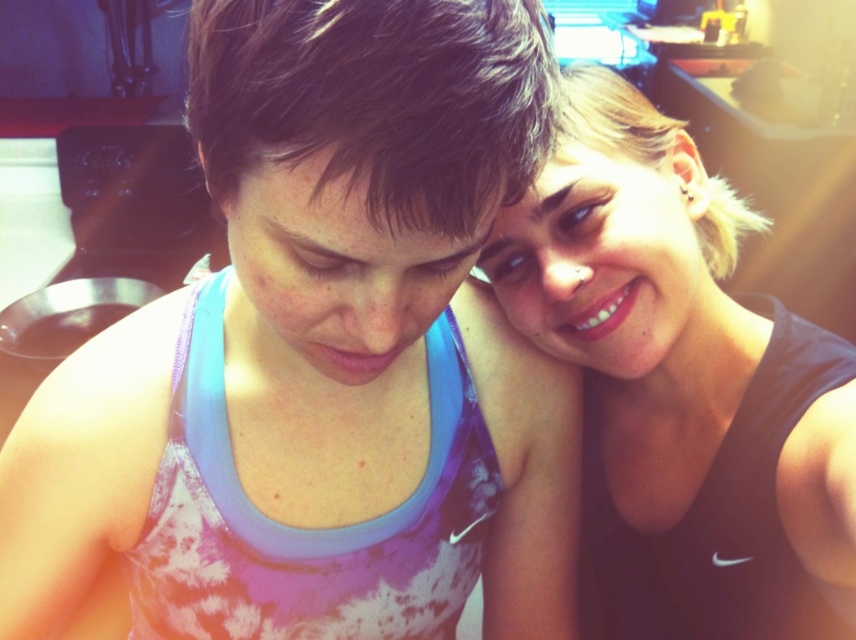
You are a photographer trying to capture a closeup of the matte blue tank top at upper right and the matte black tank top at upper right. Which one will appear larger in your photo?

The matte blue tank top at upper right will appear larger in the photo because it is closer to the viewer than the matte black tank top at upper right.

You are standing in front of the image and want to locate the matte blue tank top at upper right. According to the coordinates provided, where exactly is it positioned?

The matte blue tank top at upper right is positioned at the 2D coordinates point (x=321, y=355).

You are a photographer standing in front of the scene. You want to capture a closeup of the matte blue tank top at upper right. Based on its distance from the camera, can you confirm if it will be in focus if your camera has a depth of field that can sharply capture objects within 12 inches to 15 inches from the lens?

The matte blue tank top at upper right is 13.59 inches from the camera, which falls within the depth of field range of 12 inches to 15 inches. Therefore, the matte blue tank top at upper right will be in focus.